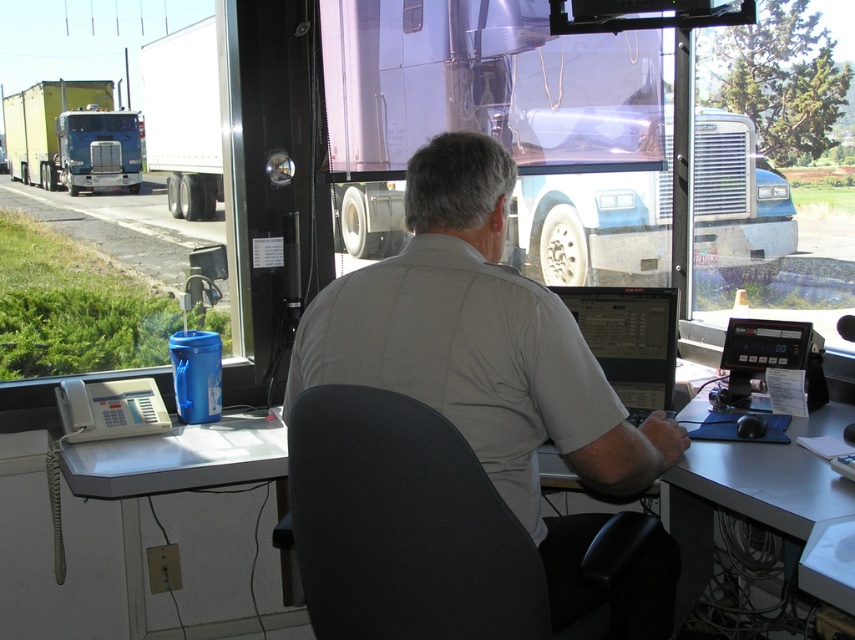
Question: Can you confirm if black fabric chair at center is thinner than white plastic table at lower left?

Choices:
 (A) yes
 (B) no

Answer: (B)

Question: Based on their relative distances, which object is nearer to the white plastic table at lower left?

Choices:
 (A) gray plastic table at center
 (B) white plastic desk at center

Answer: (A)

Question: Is white plastic table at lower left in front of yellow-green trailer truck at left?

Choices:
 (A) yes
 (B) no

Answer: (A)

Question: Which object is positioned farthest from the gray cotton shirt at center?

Choices:
 (A) yellow-green trailer truck at left
 (B) black fabric chair at center
 (C) gray plastic table at center

Answer: (A)

Question: Which point is farther to the camera?

Choices:
 (A) (444, 628)
 (B) (86, 152)

Answer: (B)

Question: Can you confirm if black fabric chair at center is positioned below white plastic table at lower left?

Choices:
 (A) no
 (B) yes

Answer: (B)